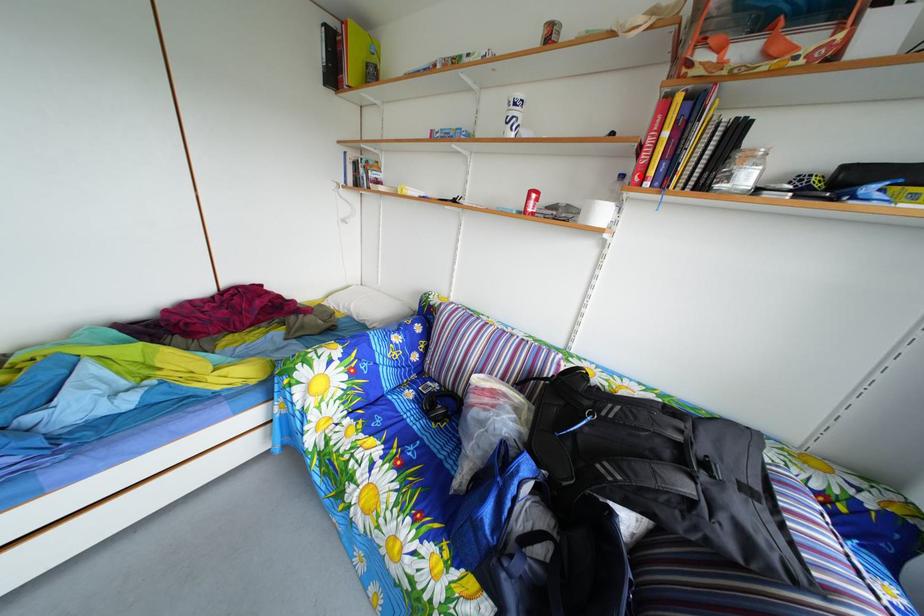
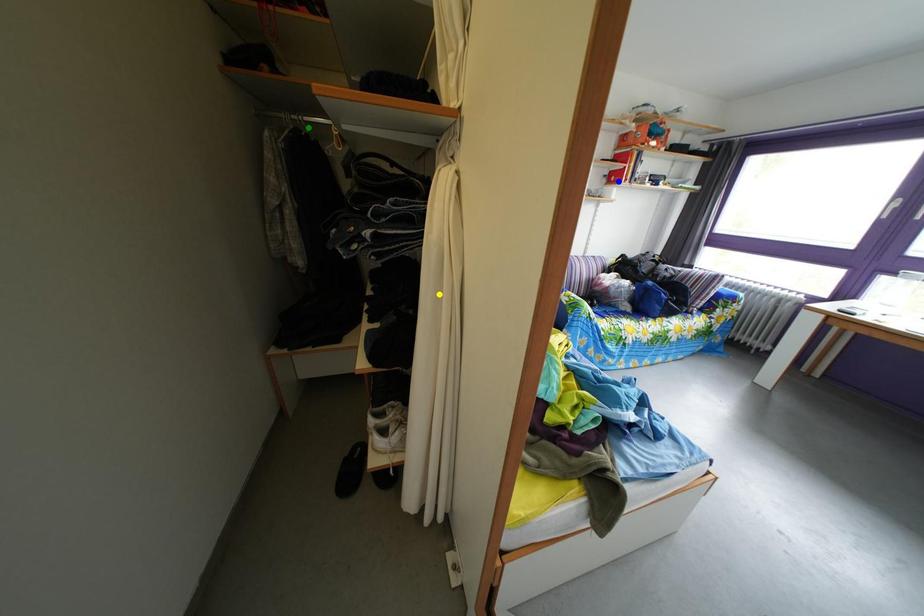
Question: I am providing you with two images of the same scene from different viewpoints. A red point is marked on the first image. You are given multiple points on the second image. Which spot in image 2 lines up with the point in image 1?

Choices:
 (A) green point
 (B) blue point
 (C) yellow point

Answer: (B)